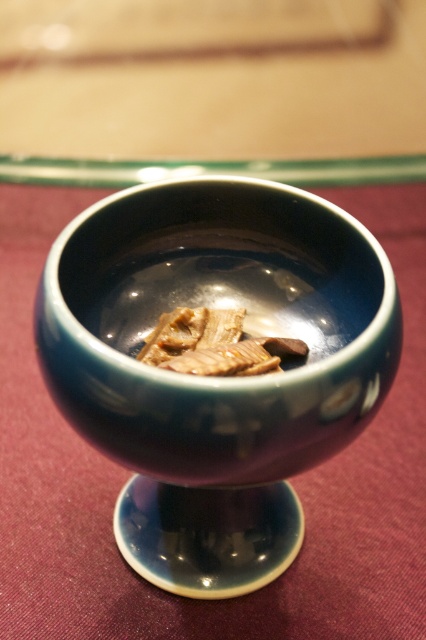
Question: Is blue glossy bowl at center positioned in front of brown matte meat at center?

Choices:
 (A) no
 (B) yes

Answer: (A)

Question: Does blue glossy bowl at center appear on the left side of brown matte meat at center?

Choices:
 (A) yes
 (B) no

Answer: (A)

Question: Observing the image, what is the correct spatial positioning of blue glossy bowl at center in reference to brown matte meat at center?

Choices:
 (A) above
 (B) below

Answer: (B)

Question: Which point is closer to the camera?

Choices:
 (A) brown matte meat at center
 (B) blue glossy bowl at center

Answer: (A)